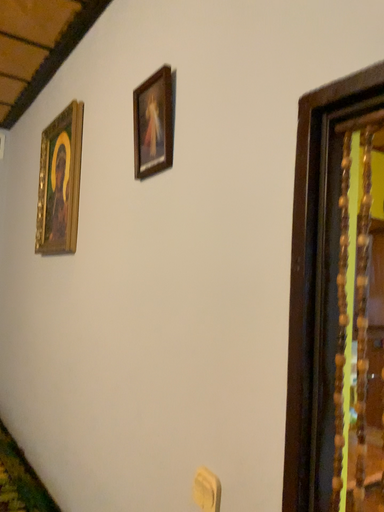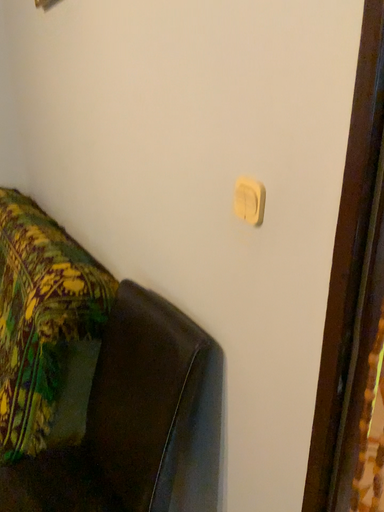
Question: Which way did the camera rotate in the video?

Choices:
 (A) rotated upward
 (B) rotated downward

Answer: (B)